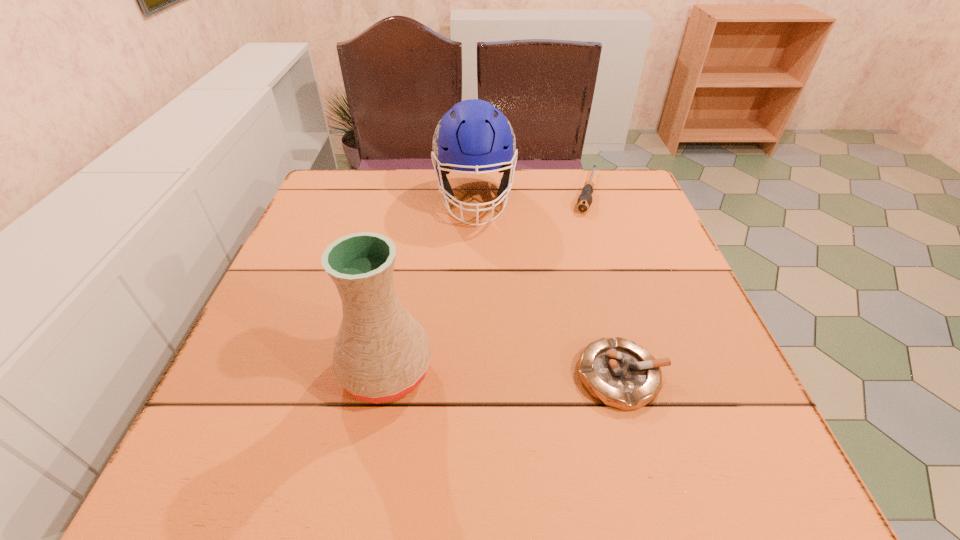
I want to click on free space located on the face guard of the football helmet, so click(483, 322).

Locate an element on the screen. Image resolution: width=960 pixels, height=540 pixels. free space located on the face guard of the football helmet is located at coordinates (481, 293).

Locate an element on the screen. The height and width of the screenshot is (540, 960). screwdriver that is at the far edge is located at coordinates (584, 201).

This screenshot has height=540, width=960. I want to click on football helmet present at the far edge, so click(473, 135).

Find the location of a particular element. The height and width of the screenshot is (540, 960). pottery that is at the near edge is located at coordinates (381, 353).

Where is `ashtray that is at the near edge`? ashtray that is at the near edge is located at coordinates (618, 372).

At what (x,y) coordinates should I click in order to perform the action: click on ashtray that is at the right edge. Please return your answer as a coordinate pair (x, y). Looking at the image, I should click on (618, 372).

The image size is (960, 540). Identify the location of screwdriver that is at the right edge. (584, 201).

Identify the location of object at the far right corner. (584, 201).

This screenshot has height=540, width=960. Identify the location of object present at the near right corner. (618, 372).